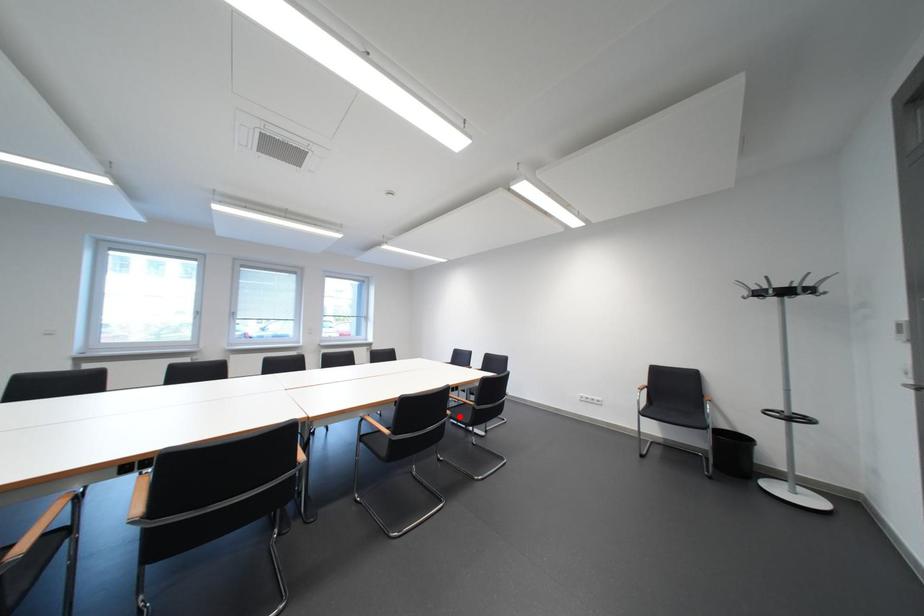
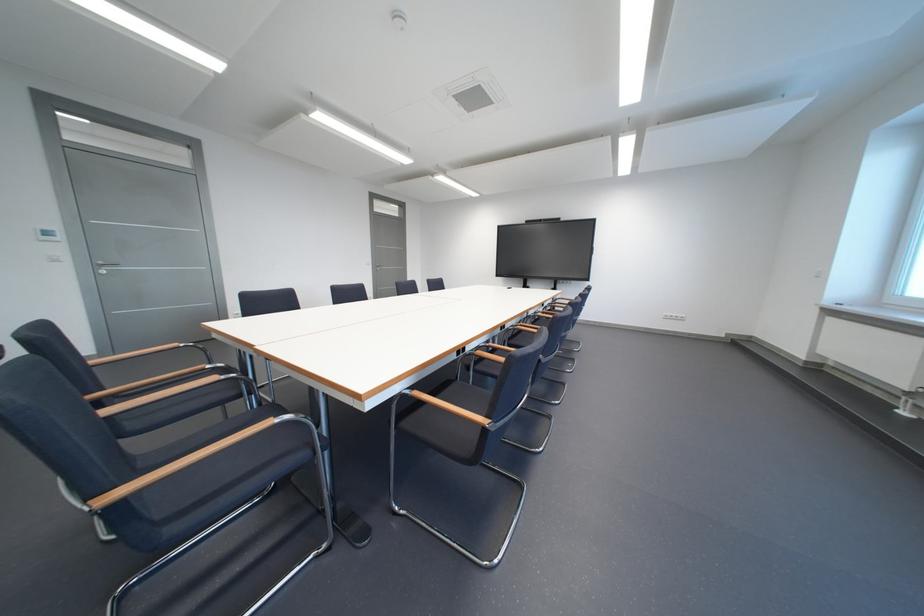
Question: I am providing you with two images of the same scene from different viewpoints. A red point is marked on the first image. Can you still see the location of the red point in image 2?

Choices:
 (A) Yes
 (B) No

Answer: (B)